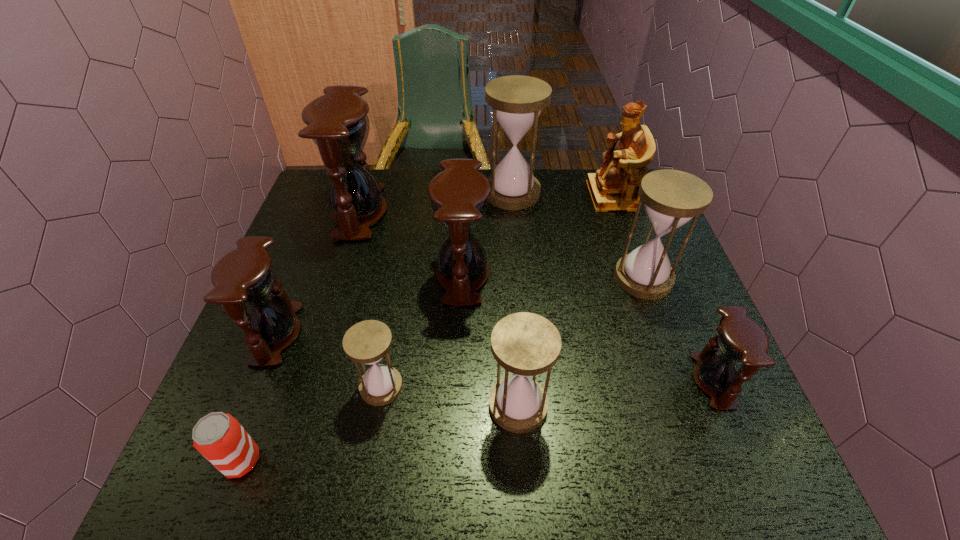
This screenshot has width=960, height=540. I want to click on free location located on the right of the third biggest brown hourglass, so click(x=466, y=334).

At what (x,y) coordinates should I click in order to perform the action: click on blank area located on the right of the third biggest white hourglass. Please return your answer as a coordinate pair (x, y). The height and width of the screenshot is (540, 960). Looking at the image, I should click on point(726,406).

Identify the location of vacant space situated on the front of the rightmost brown hourglass. This screenshot has height=540, width=960. (750, 469).

You are a GUI agent. You are given a task and a screenshot of the screen. Output one action in this format:
    pyautogui.click(x=<x>, y=<y>)
    Task: Click on the free spot located on the back of the third hourglass from left to right
    This screenshot has height=540, width=960.
    Given the screenshot: What is the action you would take?
    pyautogui.click(x=401, y=271)

Where is `vacant region located 0.050m on the back of the shortest object`? This screenshot has width=960, height=540. vacant region located 0.050m on the back of the shortest object is located at coordinates (257, 417).

Where is `figurine located in the far edge section of the desktop`? This screenshot has width=960, height=540. figurine located in the far edge section of the desktop is located at coordinates (613, 188).

I want to click on object that is at the near edge, so click(x=220, y=438).

This screenshot has height=540, width=960. I want to click on beer can present at the left edge, so click(220, 438).

Where is `figurine at the right edge`? The image size is (960, 540). figurine at the right edge is located at coordinates (613, 188).

Find the location of a particular element. The width and height of the screenshot is (960, 540). object that is positioned at the far left corner is located at coordinates (337, 122).